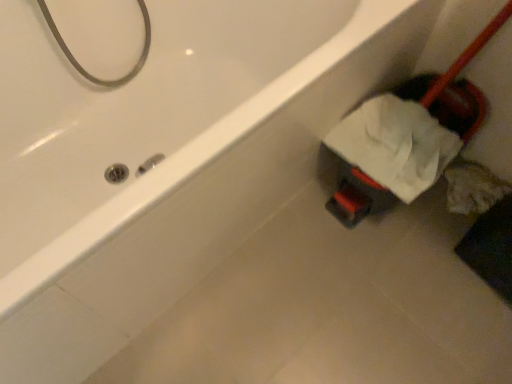
Describe the element at coordinates (395, 145) in the screenshot. I see `white matte toilet paper at lower right` at that location.

Find the location of a particular element. This screenshot has height=384, width=512. white matte toilet paper at lower right is located at coordinates (395, 145).

I want to click on white matte toilet paper at lower right, so click(395, 145).